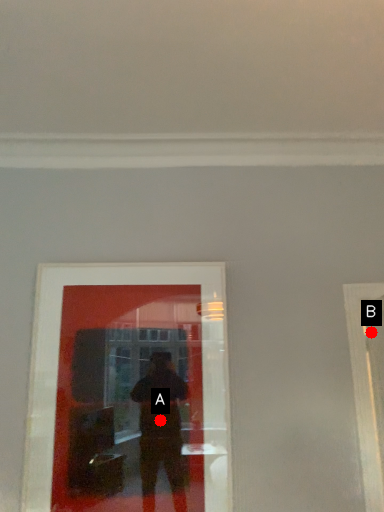
Question: Two points are circled on the image, labeled by A and B beside each circle. Which point is closer to the camera?

Choices:
 (A) A is closer
 (B) B is closer

Answer: (A)